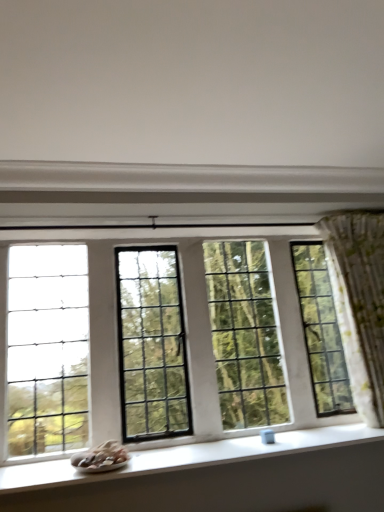
Question: From the image's perspective, is white smooth window sill at lower center beneath green floral fabric curtain at right?

Choices:
 (A) yes
 (B) no

Answer: (A)

Question: Is white smooth window sill at lower center to the right of green floral fabric curtain at right from the viewer's perspective?

Choices:
 (A) yes
 (B) no

Answer: (B)

Question: Is white smooth window sill at lower center positioned before green floral fabric curtain at right?

Choices:
 (A) yes
 (B) no

Answer: (A)

Question: Is white smooth window sill at lower center thinner than green floral fabric curtain at right?

Choices:
 (A) yes
 (B) no

Answer: (B)

Question: Considering the relative sizes of white smooth window sill at lower center and green floral fabric curtain at right in the image provided, is white smooth window sill at lower center taller than green floral fabric curtain at right?

Choices:
 (A) no
 (B) yes

Answer: (A)

Question: Considering the positions of clear glass window at center and white matte wall at upper center in the image, is clear glass window at center bigger or smaller than white matte wall at upper center?

Choices:
 (A) small
 (B) big

Answer: (B)

Question: Is point (59, 294) closer or farther from the camera than point (357, 42)?

Choices:
 (A) closer
 (B) farther

Answer: (B)

Question: From the image's perspective, is clear glass window at center positioned above or below white matte wall at upper center?

Choices:
 (A) below
 (B) above

Answer: (A)

Question: In terms of width, does clear glass window at center look wider or thinner when compared to white matte wall at upper center?

Choices:
 (A) thin
 (B) wide

Answer: (A)

Question: Looking at their shapes, would you say white matte wall at upper center is wider or thinner than clear glass window at center?

Choices:
 (A) wide
 (B) thin

Answer: (A)

Question: Is white matte wall at upper center to the left or to the right of clear glass window at center in the image?

Choices:
 (A) left
 (B) right

Answer: (B)

Question: Is white matte wall at upper center spatially inside clear glass window at center, or outside of it?

Choices:
 (A) inside
 (B) outside

Answer: (B)

Question: Considering their positions, is white matte wall at upper center located in front of or behind clear glass window at center?

Choices:
 (A) front
 (B) behind

Answer: (A)

Question: Do you think green floral fabric curtain at right is within clear glass window at center, or outside of it?

Choices:
 (A) outside
 (B) inside

Answer: (A)

Question: From the image's perspective, is green floral fabric curtain at right positioned above or below clear glass window at center?

Choices:
 (A) below
 (B) above

Answer: (B)